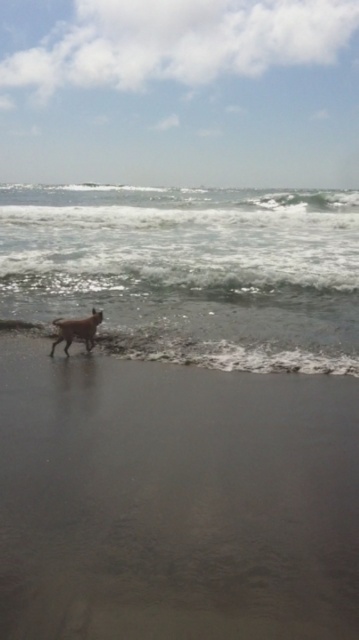
You are standing at the center of the beach scene. You want to find the brown sand at lower left. Which direction should you walk to reach it?

You should walk towards the lower left direction to reach the brown sand at lower left.

Based on the photo, you are a dog owner whose dog is walking on the brown sand at lower left and clear water at lower left. Which surface would your dog prefer to walk on if it prefers thinner surfaces?

The brown sand at lower left is thinner than clear water at lower left, so the dog would prefer to walk on the brown sand at lower left.